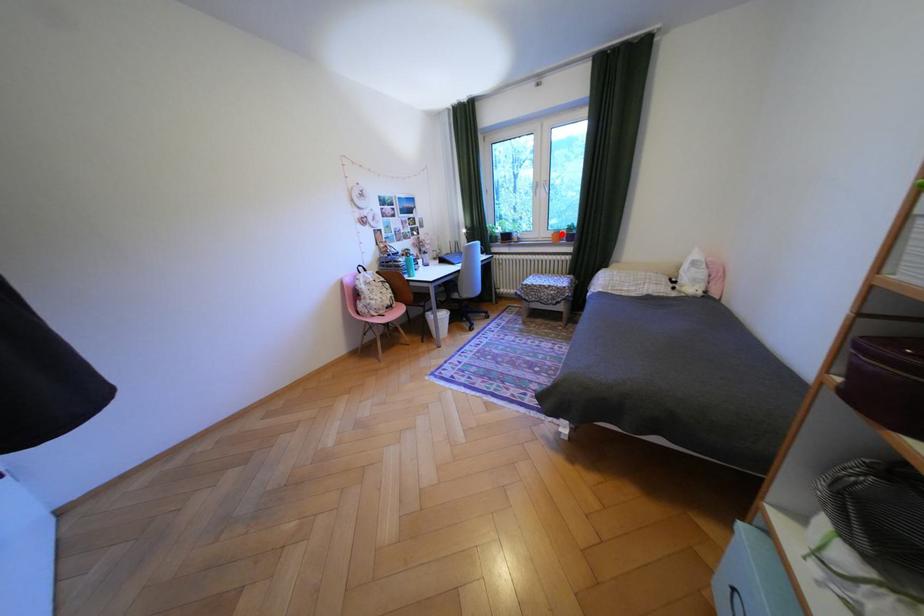
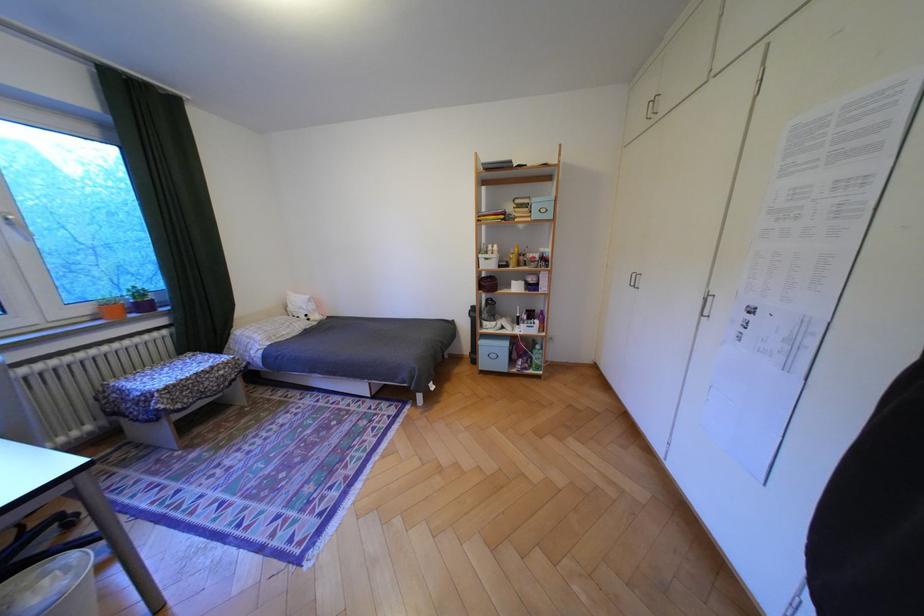
Where in the second image is the point corresponding to the highlighted location from the first image?

(99, 310)